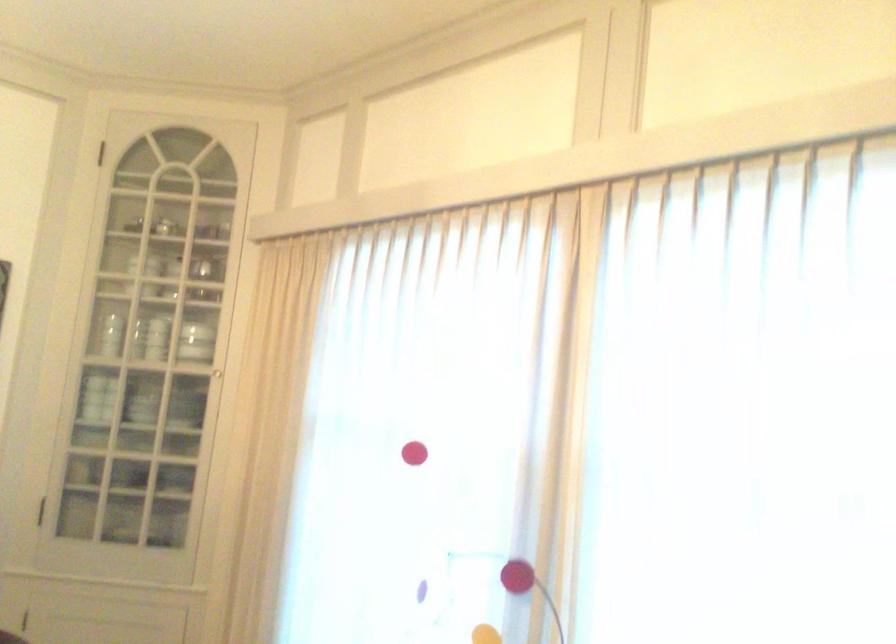
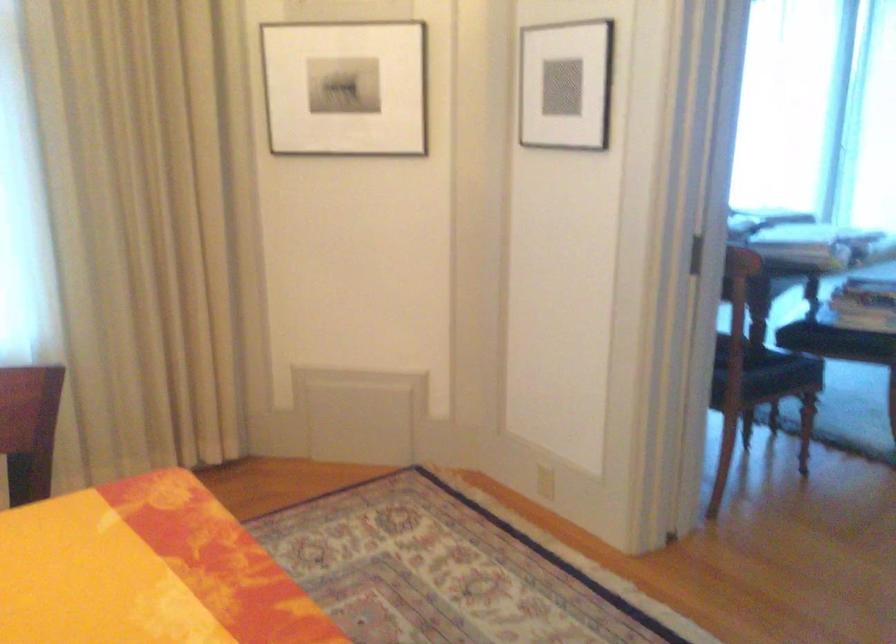
The images are taken continuously from a first-person perspective. In which direction is your viewpoint rotating?

The rotation direction of the camera is right-down.